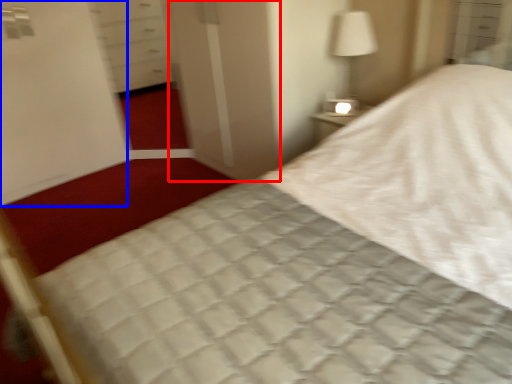
Question: Among these objects, which one is nearest to the camera, screen door (highlighted by a red box) or screen door (highlighted by a blue box)?

Choices:
 (A) screen door
 (B) screen door

Answer: (A)